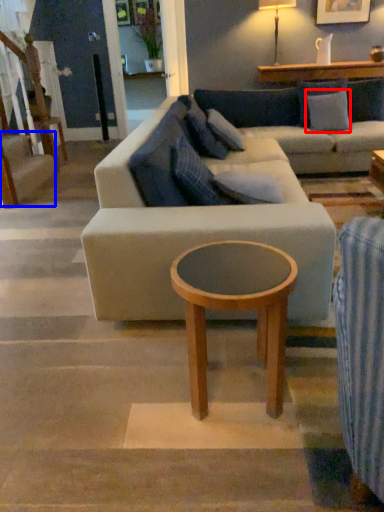
Question: Which point is closer to the camera, pillow (highlighted by a red box) or stairwell (highlighted by a blue box)?

Choices:
 (A) pillow
 (B) stairwell

Answer: (B)